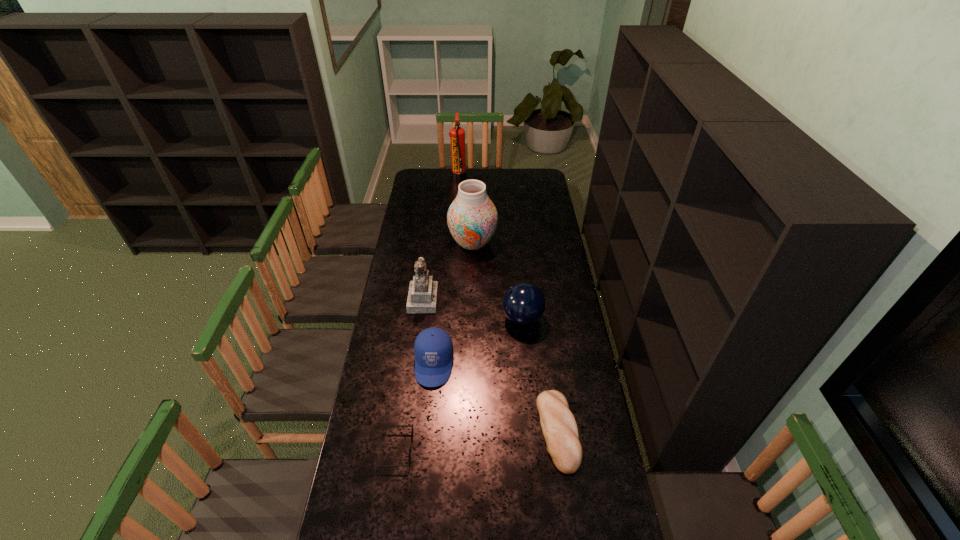
I want to click on bowling ball located at the right edge, so click(x=524, y=304).

I want to click on bread that is at the right edge, so click(x=559, y=427).

Identify the location of vacant space at the left edge. This screenshot has width=960, height=540. (411, 191).

The width and height of the screenshot is (960, 540). In the image, there is a desktop. Find the location of `vacant space at the right edge`. vacant space at the right edge is located at coordinates (532, 234).

Where is `free space at the far right corner of the desktop`? free space at the far right corner of the desktop is located at coordinates (546, 175).

The height and width of the screenshot is (540, 960). In order to click on vacant point located between the farthest object and the fourth shortest object in this screenshot , I will do `click(491, 247)`.

Locate an element on the screen. vacant area between the cap and the sunglasses is located at coordinates (416, 407).

Locate an element on the screen. The width and height of the screenshot is (960, 540). unoccupied area between the bread and the shortest object is located at coordinates (477, 440).

Locate an element on the screen. The width and height of the screenshot is (960, 540). free spot between the bowling ball and the farthest object is located at coordinates (491, 247).

This screenshot has height=540, width=960. I want to click on vacant area that lies between the figurine and the sixth nearest object, so click(x=447, y=271).